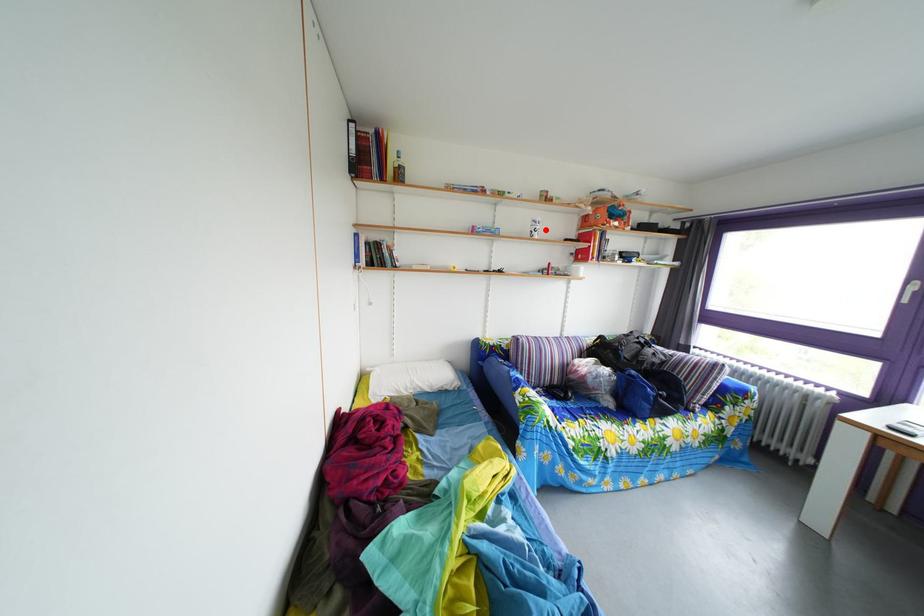
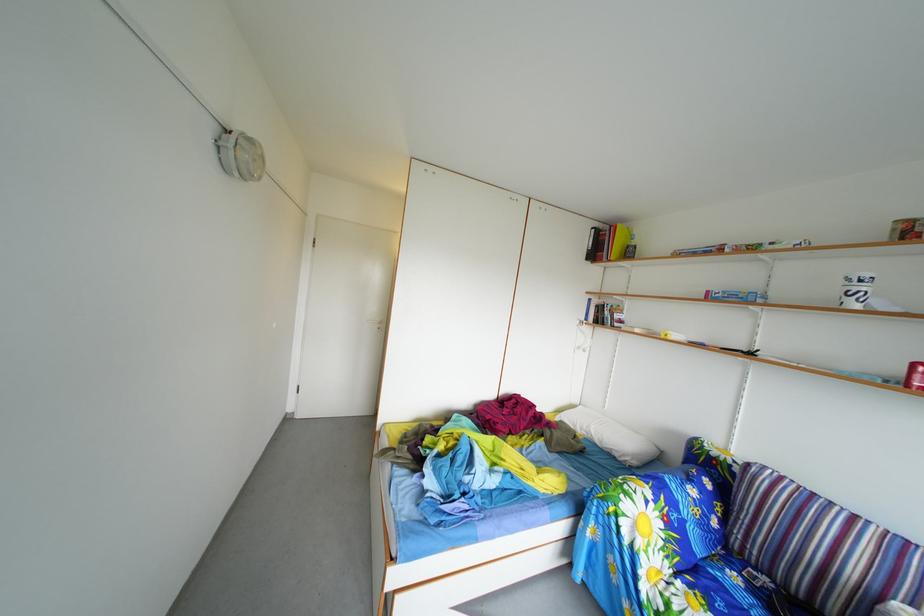
Question: A red point is marked in image1. In image2, is the corresponding 3D point closer to the camera or farther? Reply with the corresponding letter.

Choices:
 (A) The corresponding 3D point is closer.
 (B) The corresponding 3D point is farther.

Answer: (B)